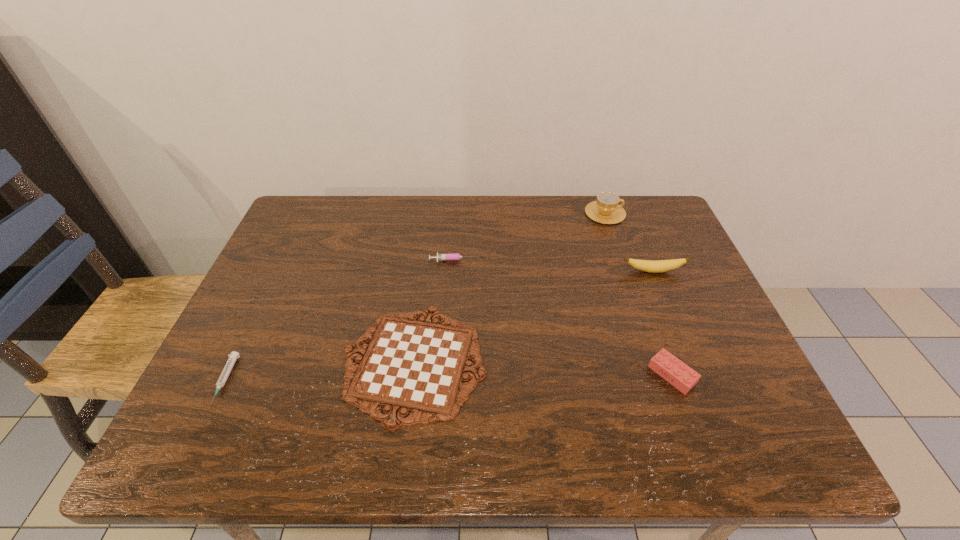
Find the location of a particular element. Image resolution: width=960 pixels, height=540 pixels. unoccupied area between the farthest object and the leftmost object is located at coordinates (416, 296).

Locate an element on the screen. free area in between the farthest object and the chessboard is located at coordinates (510, 288).

Identify the location of free area in between the cup and the right syringe. (530, 237).

I want to click on vacant area between the fifth shortest object and the fourth tallest object, so click(x=554, y=266).

You are a GUI agent. You are given a task and a screenshot of the screen. Output one action in this format:
    pyautogui.click(x=<x>, y=<y>)
    Task: Click on the vacant area that lies between the Lego and the cup
    The width and height of the screenshot is (960, 540).
    Given the screenshot: What is the action you would take?
    pyautogui.click(x=638, y=294)

What are the coordinates of `unoccupied position between the Lego and the cup` in the screenshot? It's located at (638, 294).

Where is `unoccupied position between the shorter syringe and the cup`? The height and width of the screenshot is (540, 960). unoccupied position between the shorter syringe and the cup is located at coordinates (416, 296).

Find the location of `the fourth closest object to the banana`. the fourth closest object to the banana is located at coordinates (418, 366).

Choose which object is the fifth nearest neighbor to the chessboard. Please provide its 2D coordinates. Your answer should be formatted as a tuple, i.e. [(x, y)], where the tuple contains the x and y coordinates of a point satisfying the conditions above.

[(606, 210)]

Locate an element on the screen. This screenshot has height=540, width=960. vacant space that satisfies the following two spatial constraints: 1. with the handle on the side of the cup; 2. on the back side of the fourth shortest object is located at coordinates (660, 375).